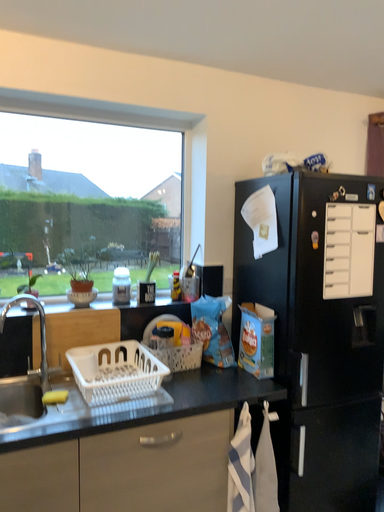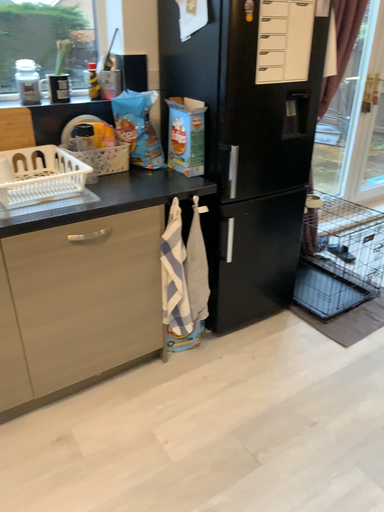
Question: How did the camera likely rotate when shooting the video?

Choices:
 (A) rotated upward
 (B) rotated downward

Answer: (B)